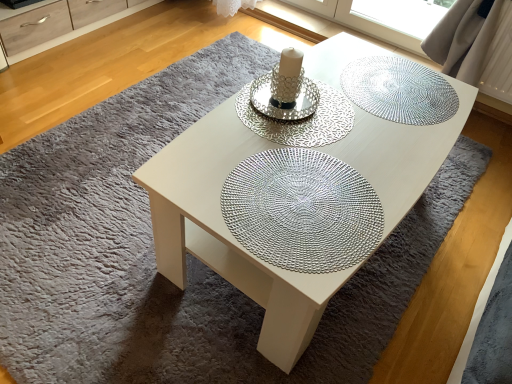
At what (x,y) coordinates should I click in order to perform the action: click on empty space that is to the right of silver metallic doily at center, the 2th glass plate in the back-to-front sequence. Please return your answer as a coordinate pair (x, y). The width and height of the screenshot is (512, 384). Looking at the image, I should click on (398, 144).